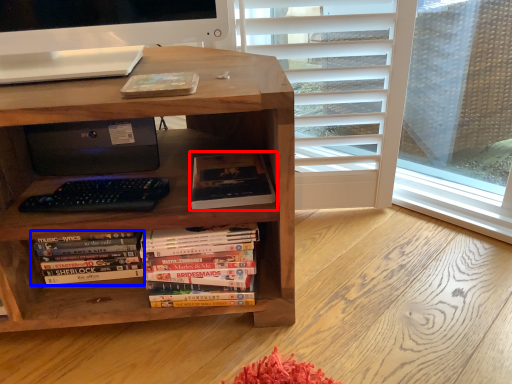
Question: Among these objects, which one is farthest to the camera, book (highlighted by a red box) or book (highlighted by a blue box)?

Choices:
 (A) book
 (B) book

Answer: (B)